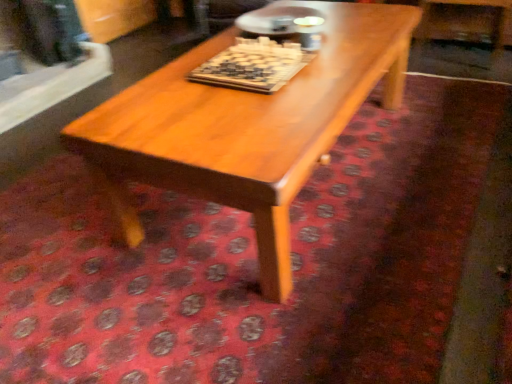
Identify the location of vacant area to the right of wooden chessboard at center. The width and height of the screenshot is (512, 384). (343, 63).